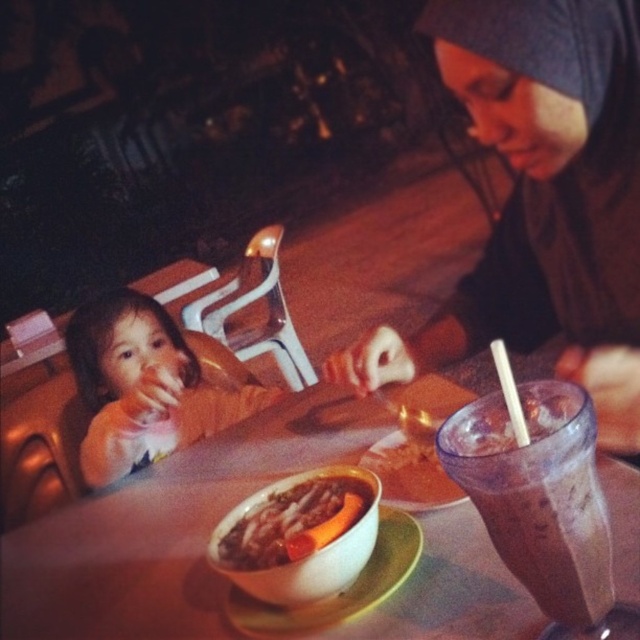
You are a photographer holding a camera and want to capture a closeup shot of the chocolate milkshake at right. The camera requires a minimum distance of 18 inches to focus properly. Can you take the photo from your current position?

The chocolate milkshake at right and camera are 17.60 inches apart, which is less than the required 18 inches. Therefore, you cannot take the photo from your current position as the camera won not focus properly.

You are a server at the restaurant and need to place a new dish on the table. The dish is as wide as the smooth white bowl at center. Will it fit on the smooth wooden table at center without overhanging the edges?

The smooth wooden table at center is wider than the smooth white bowl at center, so the dish will fit without overhanging the edges.

You are a waiter in a restaurant and need to serve a customer who wants to reach the chocolate milkshake at right and the smooth orange carrot at center. From the customer seat, which item is closer to the right edge of the table?

The chocolate milkshake at right is to the right of the smooth orange carrot at center, so the chocolate milkshake at right is closer to the right edge of the table.